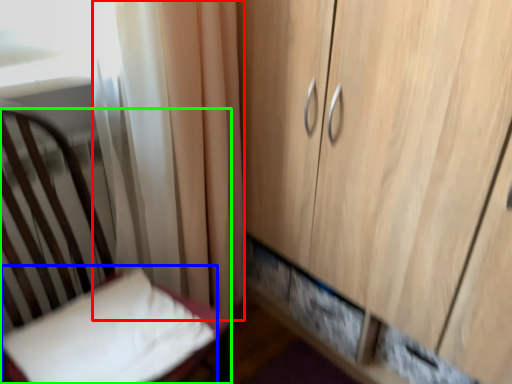
Question: Which object is positioned farthest from curtain (highlighted by a red box)? Select from pillow (highlighted by a blue box) and furniture (highlighted by a green box).

Choices:
 (A) pillow
 (B) furniture

Answer: (A)